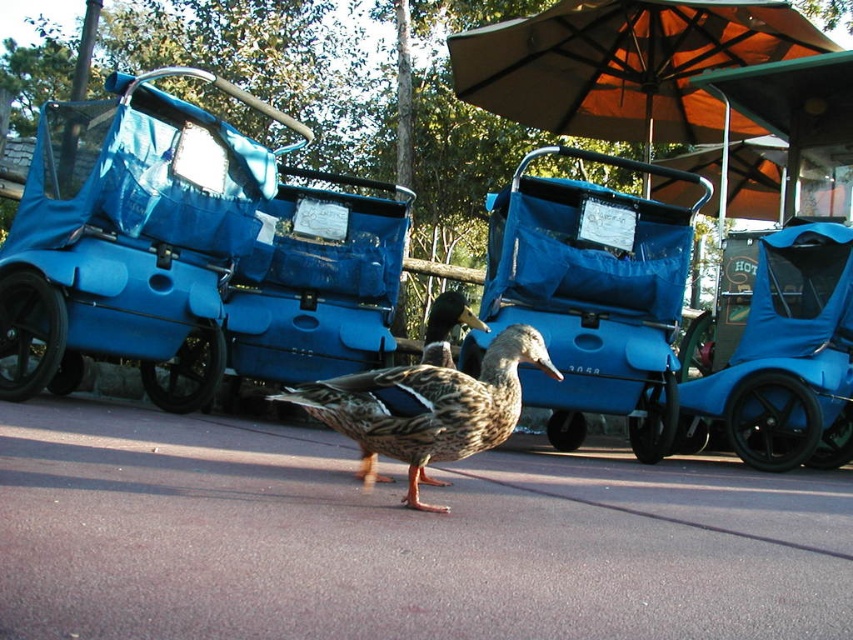
Is brown asphalt at center thinner than blue matte golf cart at center?

Incorrect, brown asphalt at center's width is not less than blue matte golf cart at center's.

Is brown asphalt at center closer to camera compared to blue matte golf cart at center?

Yes.

This screenshot has height=640, width=853. Describe the element at coordinates (393, 540) in the screenshot. I see `brown asphalt at center` at that location.

You are a GUI agent. You are given a task and a screenshot of the screen. Output one action in this format:
    pyautogui.click(x=<x>, y=<y>)
    Task: Click on the brown asphalt at center
    
    Given the screenshot: What is the action you would take?
    pyautogui.click(x=393, y=540)

Between point (486, 605) and point (328, 392), which one is positioned behind?

The point (328, 392) is more distant.

Is point (804, 618) closer to viewer compared to point (355, 440)?

Yes.

Image resolution: width=853 pixels, height=640 pixels. I want to click on brown asphalt at center, so click(393, 540).

Measure the distance from brown fabric umbrella at upper center to brown speckled feathers at center.

The distance of brown fabric umbrella at upper center from brown speckled feathers at center is 2.56 meters.

Does brown fabric umbrella at upper center have a greater height compared to brown speckled feathers at center?

Indeed, brown fabric umbrella at upper center has a greater height compared to brown speckled feathers at center.

Who is more distant from viewer, (688, 128) or (482, 376)?

Point (688, 128)

Identify the location of brown fabric umbrella at upper center. (625, 65).